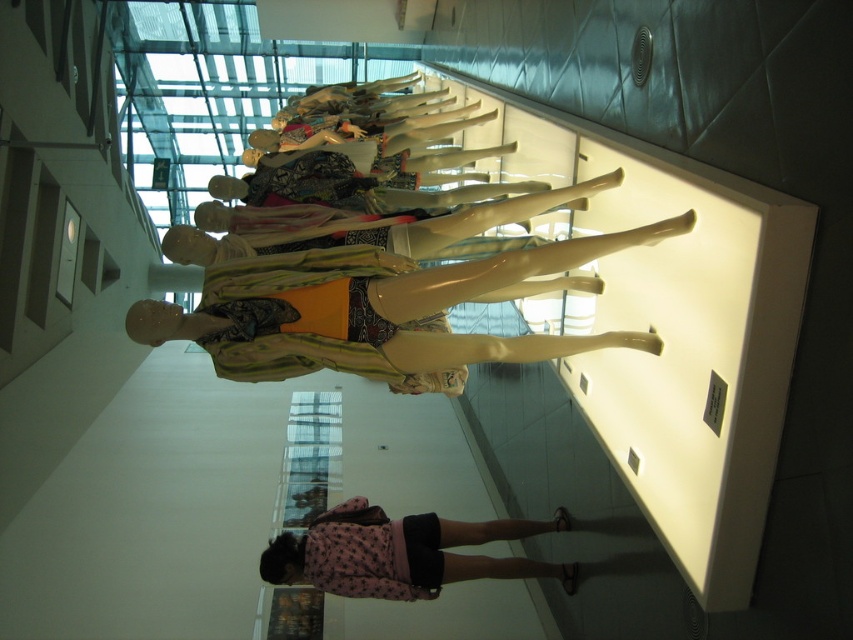
Question: Does matte yellow mannequin at center have a greater width compared to pink fabric dress at lower center?

Choices:
 (A) yes
 (B) no

Answer: (A)

Question: Is matte yellow mannequin at center to the right of pink fabric dress at lower center from the viewer's perspective?

Choices:
 (A) no
 (B) yes

Answer: (A)

Question: Is matte yellow mannequin at center above pink fabric dress at lower center?

Choices:
 (A) yes
 (B) no

Answer: (A)

Question: Which of the following is the closest to the observer?

Choices:
 (A) (265, 336)
 (B) (341, 509)

Answer: (A)

Question: Which of the following is the farthest from the observer?

Choices:
 (A) pink fabric dress at lower center
 (B) matte yellow mannequin at center

Answer: (A)

Question: Which object appears farthest from the camera in this image?

Choices:
 (A) matte yellow mannequin at center
 (B) pink fabric dress at lower center

Answer: (B)